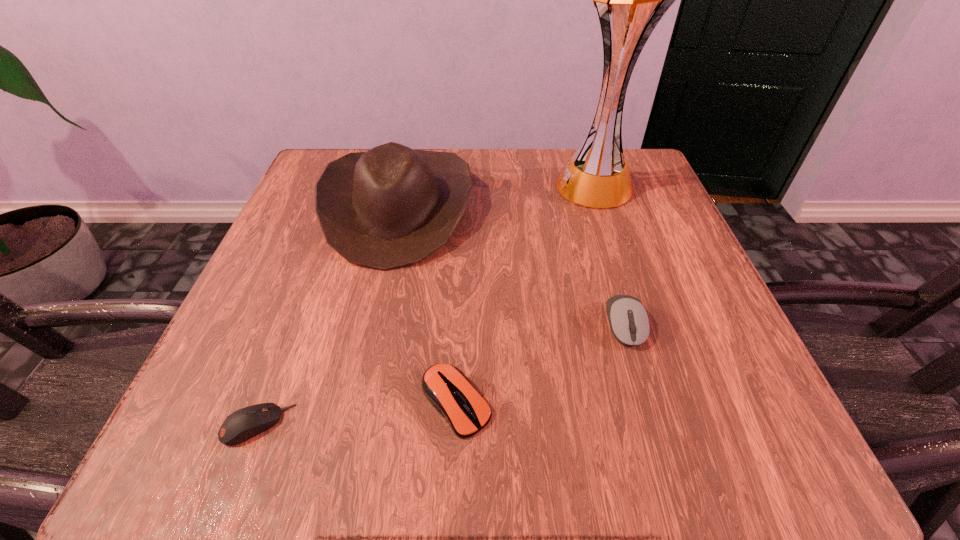
What are the coordinates of `free space located 0.300m on the front-facing side of the tallest object` in the screenshot? It's located at (418, 186).

Find the location of a particular element. vacant area situated on the right of the fourth shortest object is located at coordinates (512, 208).

The width and height of the screenshot is (960, 540). Identify the location of free space located on the wheel side of the farthest computer mouse. (640, 380).

I want to click on free region located on the right of the second computer mouse from left to right, so click(x=700, y=402).

This screenshot has height=540, width=960. I want to click on vacant space located 0.160m on the right of the shortest object, so click(x=414, y=425).

At what (x,y) coordinates should I click in order to perform the action: click on trophy positioned at the far edge. Please return your answer as a coordinate pair (x, y). Looking at the image, I should click on (630, 0).

Find the location of a particular element. cowboy hat that is at the far edge is located at coordinates (392, 206).

Find the location of a particular element. The image size is (960, 540). cowboy hat positioned at the left edge is located at coordinates (392, 206).

Locate an element on the screen. computer mouse that is at the left edge is located at coordinates (243, 424).

Locate an element on the screen. This screenshot has width=960, height=540. trophy at the right edge is located at coordinates (630, 0).